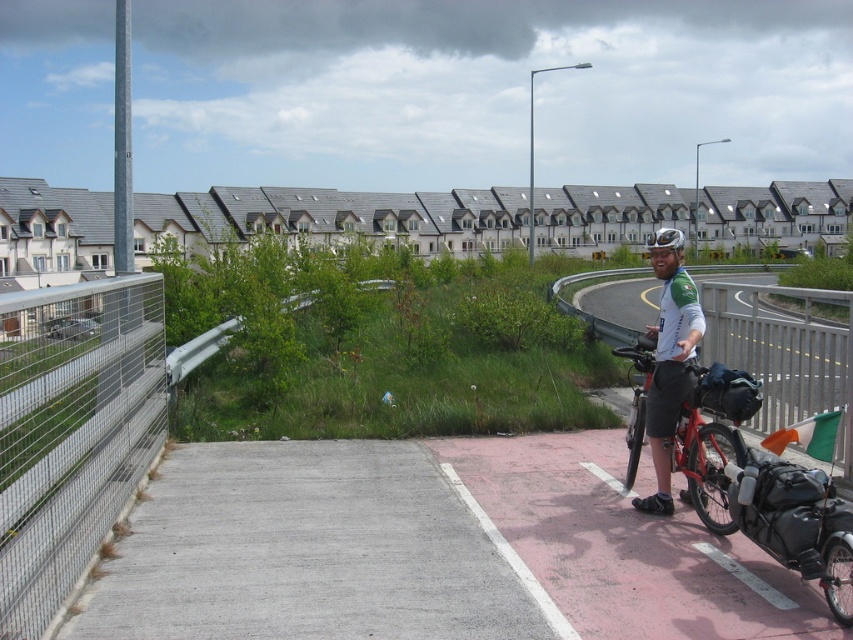
Is concrete at center smaller than white fabric shirt at center?

Yes.

Which is in front, point (0, 496) or point (666, 252)?

Positioned in front is point (0, 496).

Where is `concrete at center`? This screenshot has height=640, width=853. concrete at center is located at coordinates (80, 424).

Who is more forward, (163, 429) or (39, 525)?

Point (39, 525)

Between concrete at center and metal mesh fence at left, which one has more height?

concrete at center

The width and height of the screenshot is (853, 640). In order to click on concrete at center in this screenshot , I will do `click(80, 424)`.

Who is more distant from viewer, (24,349) or (697,481)?

The point (697,481) is more distant.

Can you confirm if metal mesh fence at left is positioned to the left of matte red bicycle at right?

Indeed, metal mesh fence at left is positioned on the left side of matte red bicycle at right.

This screenshot has height=640, width=853. I want to click on metal mesh fence at left, so click(x=73, y=429).

You are a GUI agent. You are given a task and a screenshot of the screen. Output one action in this format:
    pyautogui.click(x=<x>, y=<y>)
    Task: Click on the metal mesh fence at left
    This screenshot has height=640, width=853.
    Given the screenshot: What is the action you would take?
    pyautogui.click(x=73, y=429)